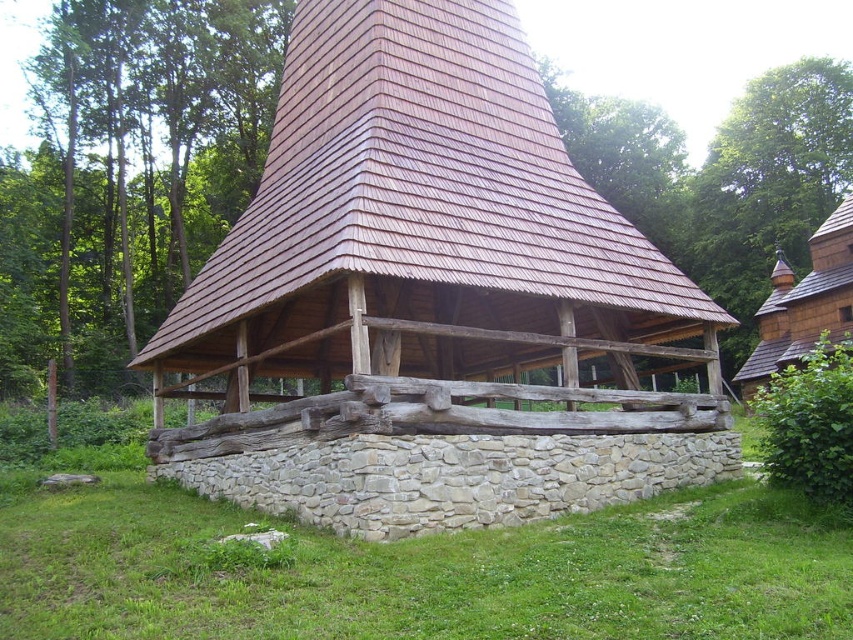
Between brown wooden shingles at center and brown wooden hut at upper right, which one appears on the right side from the viewer's perspective?

brown wooden hut at upper right

Which is behind, point (457, 218) or point (740, 394)?

The point (740, 394) is behind.

Which is in front, point (328, 0) or point (753, 356)?

Point (328, 0) is more forward.

This screenshot has height=640, width=853. I want to click on brown wooden shingles at center, so click(422, 173).

Who is lower down, green grass at lower center or brown wooden shingles at center?

green grass at lower center

Locate an element on the screen. This screenshot has width=853, height=640. green grass at lower center is located at coordinates (415, 570).

In the scene shown: Is green grass at lower center further to the viewer compared to brown wooden hut at upper right?

No, it is in front of brown wooden hut at upper right.

Locate an element on the screen. Image resolution: width=853 pixels, height=640 pixels. green grass at lower center is located at coordinates (415, 570).